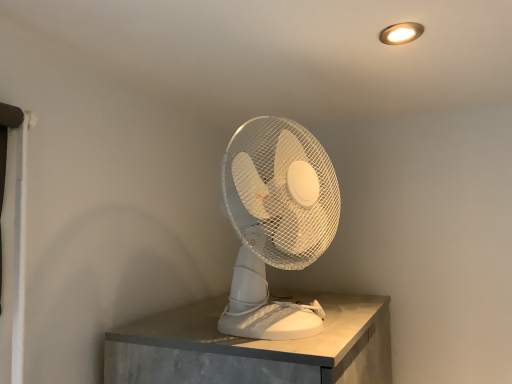
Locate an element on the screen. The height and width of the screenshot is (384, 512). matte gold light fixture at upper right is located at coordinates (401, 33).

What do you see at coordinates (401, 33) in the screenshot? The width and height of the screenshot is (512, 384). I see `matte gold light fixture at upper right` at bounding box center [401, 33].

In the scene shown: In order to face matte gold light fixture at upper right, should I rotate leftwards or rightwards?

You should look right and rotate roughly 18.685 degrees.

Locate an element on the screen. Image resolution: width=512 pixels, height=384 pixels. white plastic fan at center is located at coordinates (276, 223).

Describe the element at coordinates (276, 223) in the screenshot. This screenshot has width=512, height=384. I see `white plastic fan at center` at that location.

The width and height of the screenshot is (512, 384). I want to click on matte gold light fixture at upper right, so (401, 33).

Is matte gold light fixture at upper right at the right side of white plastic fan at center?

Indeed, matte gold light fixture at upper right is positioned on the right side of white plastic fan at center.

Does matte gold light fixture at upper right come in front of white plastic fan at center?

No, matte gold light fixture at upper right is behind white plastic fan at center.

Is point (404, 42) closer or farther from the camera than point (241, 224)?

Point (404, 42) is positioned farther from the camera compared to point (241, 224).

From the image's perspective, is matte gold light fixture at upper right above white plastic fan at center?

Yes, from the image's perspective, matte gold light fixture at upper right is over white plastic fan at center.

From a real-world perspective, relative to white plastic fan at center, is matte gold light fixture at upper right vertically above or below?

From a real-world perspective, matte gold light fixture at upper right is physically above white plastic fan at center.

Can you confirm if matte gold light fixture at upper right is thinner than white plastic fan at center?

Indeed, matte gold light fixture at upper right has a lesser width compared to white plastic fan at center.

Consider the image. From their relative heights in the image, would you say matte gold light fixture at upper right is taller or shorter than white plastic fan at center?

matte gold light fixture at upper right is shorter than white plastic fan at center.

Looking at the image, does matte gold light fixture at upper right seem bigger or smaller compared to white plastic fan at center?

matte gold light fixture at upper right is smaller than white plastic fan at center.

From the picture: Can we say matte gold light fixture at upper right lies outside white plastic fan at center?

Absolutely, matte gold light fixture at upper right is external to white plastic fan at center.

Is matte gold light fixture at upper right positioned far away from white plastic fan at center?

No.

Is matte gold light fixture at upper right positioned with its back to white plastic fan at center?

No, white plastic fan at center is not at the back of matte gold light fixture at upper right.

Locate an element on the screen. This screenshot has height=384, width=512. mechanical fan that appears on the left of matte gold light fixture at upper right is located at coordinates (276, 223).

Does white plastic fan at center appear on the left side of matte gold light fixture at upper right?

Indeed, white plastic fan at center is positioned on the left side of matte gold light fixture at upper right.

Which is in front, white plastic fan at center or matte gold light fixture at upper right?

white plastic fan at center is more forward.

Which is behind, point (286, 317) or point (415, 38)?

The point (286, 317) is more distant.

From the image's perspective, which is above, white plastic fan at center or matte gold light fixture at upper right?

matte gold light fixture at upper right is shown above in the image.

From a real-world perspective, is white plastic fan at center over matte gold light fixture at upper right?

No.

Between white plastic fan at center and matte gold light fixture at upper right, which one has smaller width?

With smaller width is matte gold light fixture at upper right.

Considering the relative sizes of white plastic fan at center and matte gold light fixture at upper right in the image provided, is white plastic fan at center taller than matte gold light fixture at upper right?

Yes, white plastic fan at center is taller than matte gold light fixture at upper right.

Considering the relative sizes of white plastic fan at center and matte gold light fixture at upper right in the image provided, is white plastic fan at center smaller than matte gold light fixture at upper right?

Incorrect, white plastic fan at center is not smaller in size than matte gold light fixture at upper right.

Is white plastic fan at center inside or outside of matte gold light fixture at upper right?

white plastic fan at center is not enclosed by matte gold light fixture at upper right.

Is white plastic fan at center beside matte gold light fixture at upper right?

No, white plastic fan at center is not beside matte gold light fixture at upper right.

Is white plastic fan at center turned away from matte gold light fixture at upper right?

white plastic fan at center does not have its back to matte gold light fixture at upper right.

How far apart are white plastic fan at center and matte gold light fixture at upper right?

white plastic fan at center is 17.44 inches from matte gold light fixture at upper right.

This screenshot has width=512, height=384. Identify the location of lamp located behind the white plastic fan at center. (401, 33).

Find the location of `lamp behind the white plastic fan at center`. lamp behind the white plastic fan at center is located at coordinates (401, 33).

I want to click on mechanical fan below the matte gold light fixture at upper right (from the image's perspective), so (x=276, y=223).